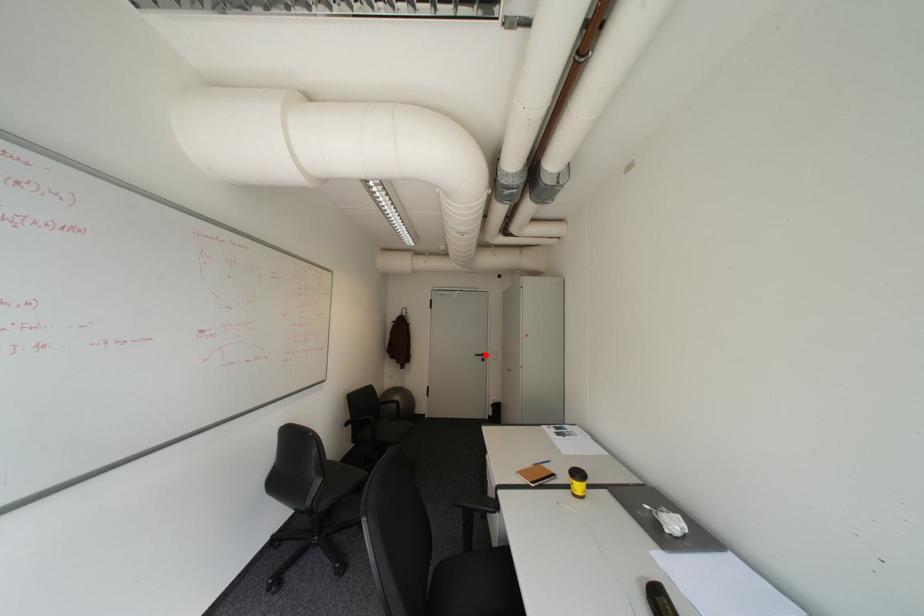
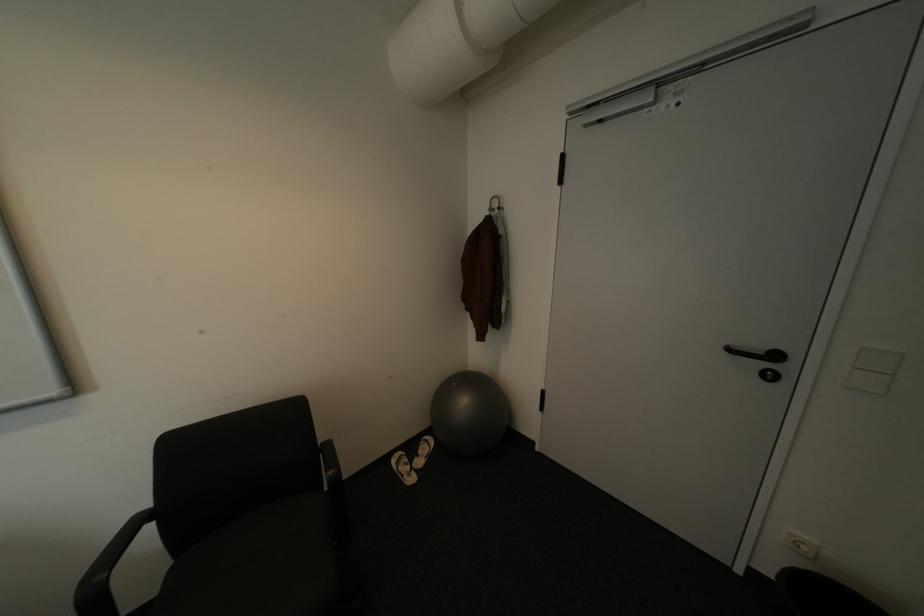
The point at the highlighted location is marked in the first image. Where is the corresponding point in the second image?

(739, 350)